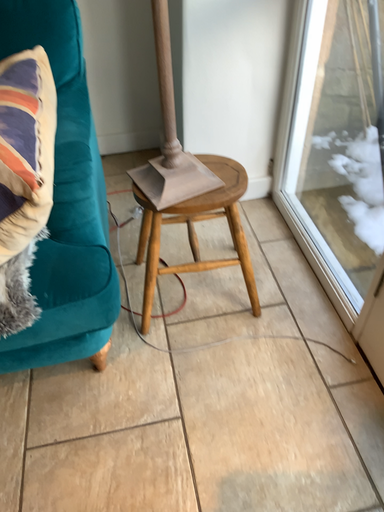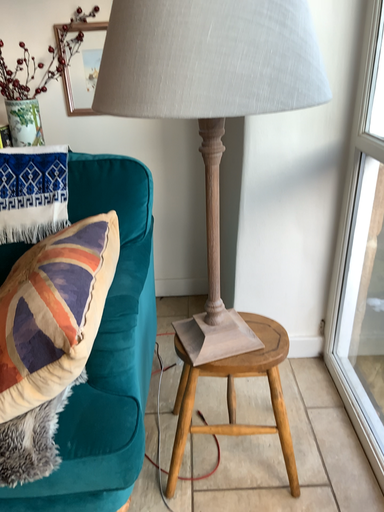
Question: Which way did the camera rotate in the video?

Choices:
 (A) rotated upward
 (B) rotated downward

Answer: (A)